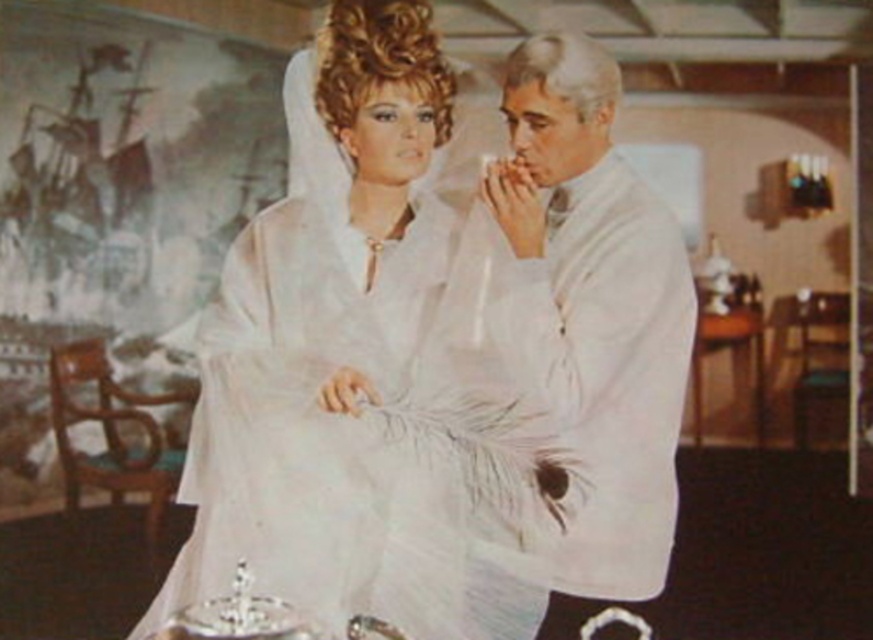
Who is positioned more to the left, white satin dress at center or white matte coat at center?

Positioned to the left is white satin dress at center.

Does white satin dress at center lie in front of white matte coat at center?

Yes, it is.

This screenshot has height=640, width=873. Describe the element at coordinates (440, 353) in the screenshot. I see `white satin dress at center` at that location.

You are a GUI agent. You are given a task and a screenshot of the screen. Output one action in this format:
    pyautogui.click(x=<x>, y=<y>)
    Task: Click on the white satin dress at center
    Image resolution: width=873 pixels, height=640 pixels.
    Given the screenshot: What is the action you would take?
    pyautogui.click(x=440, y=353)